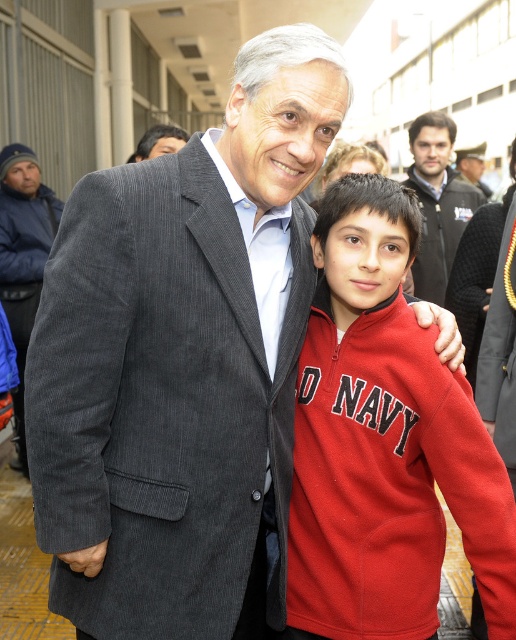
Based on the scene description, where is the blue corduroy jacket located in relation to the point marked at coordinates (23, 257)?

The blue corduroy jacket at left is located at the coordinates marked by point (23, 257).

You are a photographer standing 2 meters away from the dark gray corduroy jacket at center. You want to take a photo of both the older man in dark gray pinstripe suit jacket over light blue collared shirt and the younger person in bright red fleece. Can you fit both subjects in the frame without moving your position?

The older man in dark gray pinstripe suit jacket over light blue collared shirt and the younger person in bright red fleece are 3.81 meters apart. Since you are standing 2 meters away from the dark gray corduroy jacket at center, your camera might not have a wide enough angle to capture both subjects in the frame without moving closer or adjusting your position.